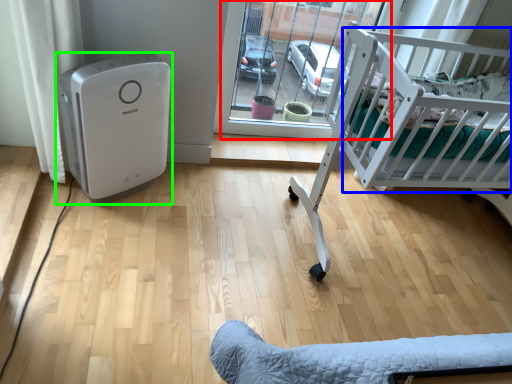
Question: Which object is the farthest from glass door (highlighted by a red box)? Choose among these: infant bed (highlighted by a blue box) or home appliance (highlighted by a green box).

Choices:
 (A) infant bed
 (B) home appliance

Answer: (B)